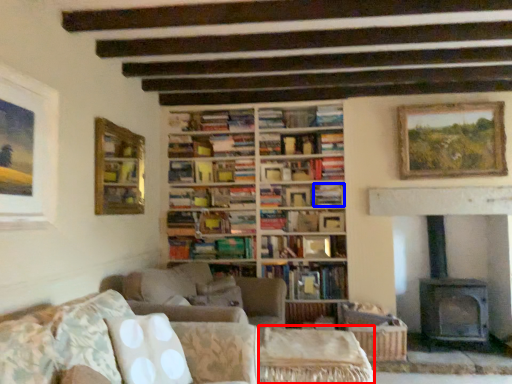
Question: Which point is further to the camera, side table (highlighted by a red box) or book (highlighted by a blue box)?

Choices:
 (A) side table
 (B) book

Answer: (B)